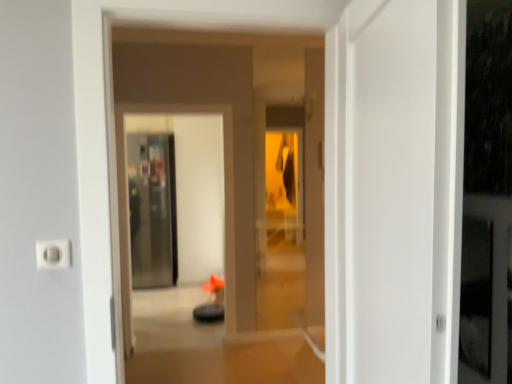
Question: From a real-world perspective, is transparent glass screen door at center, which ranks as the second screen door in front-to-back order, positioned under white plastic electric outlet at lower left based on gravity?

Choices:
 (A) yes
 (B) no

Answer: (A)

Question: Is transparent glass screen door at center, the first screen door when ordered from back to front, wider than white plastic electric outlet at lower left?

Choices:
 (A) yes
 (B) no

Answer: (A)

Question: From the image's perspective, is transparent glass screen door at center, which is the 2th screen door from right to left, above white plastic electric outlet at lower left?

Choices:
 (A) yes
 (B) no

Answer: (B)

Question: Is the surface of transparent glass screen door at center, the first screen door when ordered from back to front, in direct contact with white plastic electric outlet at lower left?

Choices:
 (A) no
 (B) yes

Answer: (A)

Question: Is transparent glass screen door at center, which is the 2th screen door from right to left, shorter than white plastic electric outlet at lower left?

Choices:
 (A) no
 (B) yes

Answer: (A)

Question: From a real-world perspective, is orange fabric chair at center positioned above or below transparent glass screen door at center, which is the 2th screen door from right to left?

Choices:
 (A) above
 (B) below

Answer: (A)

Question: Does point (151, 41) appear closer or farther from the camera than point (126, 167)?

Choices:
 (A) farther
 (B) closer

Answer: (B)

Question: Is orange fabric chair at center to the left or to the right of transparent glass screen door at center, the first screen door when ordered from left to right, in the image?

Choices:
 (A) left
 (B) right

Answer: (B)

Question: Considering the positions of orange fabric chair at center and transparent glass screen door at center, which is the 2th screen door from right to left, in the image, is orange fabric chair at center taller or shorter than transparent glass screen door at center, which is the 2th screen door from right to left,?

Choices:
 (A) short
 (B) tall

Answer: (A)

Question: In terms of height, does transparent glass screen door at center, which appears as the second screen door when viewed from the left, look taller or shorter compared to orange fabric chair at center?

Choices:
 (A) tall
 (B) short

Answer: (A)

Question: In terms of size, does transparent glass screen door at center, which appears as the second screen door when viewed from the left, appear bigger or smaller than orange fabric chair at center?

Choices:
 (A) small
 (B) big

Answer: (B)

Question: Relative to orange fabric chair at center, is transparent glass screen door at center, which is the first screen door from front to back, in front or behind?

Choices:
 (A) front
 (B) behind

Answer: (B)

Question: Would you say transparent glass screen door at center, which is the first screen door from front to back, is to the left or to the right of orange fabric chair at center in the picture?

Choices:
 (A) right
 (B) left

Answer: (B)

Question: Is point (119, 253) closer or farther from the camera than point (175, 281)?

Choices:
 (A) farther
 (B) closer

Answer: (B)

Question: Is transparent glass screen door at center, which appears as the second screen door when viewed from the left, to the left or to the right of transparent glass screen door at center, which ranks as the second screen door in front-to-back order, in the image?

Choices:
 (A) right
 (B) left

Answer: (A)